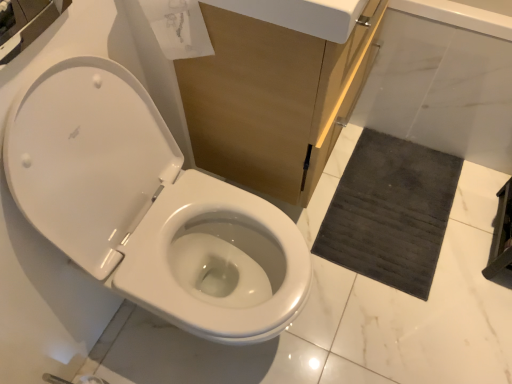
Question: Based on their sizes in the image, would you say dark gray textured bath mat at lower right is bigger or smaller than white marble bath at lower right?

Choices:
 (A) big
 (B) small

Answer: (B)

Question: From a real-world perspective, is dark gray textured bath mat at lower right positioned above or below white marble bath at lower right?

Choices:
 (A) below
 (B) above

Answer: (A)

Question: Estimate the real-world distances between objects in this image. Which object is farther from the dark gray textured bath mat at lower right?

Choices:
 (A) matte wood cabinet at center
 (B) transparent paper at upper center
 (C) white glossy toilet at left
 (D) white marble bath at lower right

Answer: (B)

Question: Which object is the closest to the dark gray textured bath mat at lower right?

Choices:
 (A) white marble bath at lower right
 (B) white glossy toilet at left
 (C) matte wood cabinet at center
 (D) transparent paper at upper center

Answer: (A)